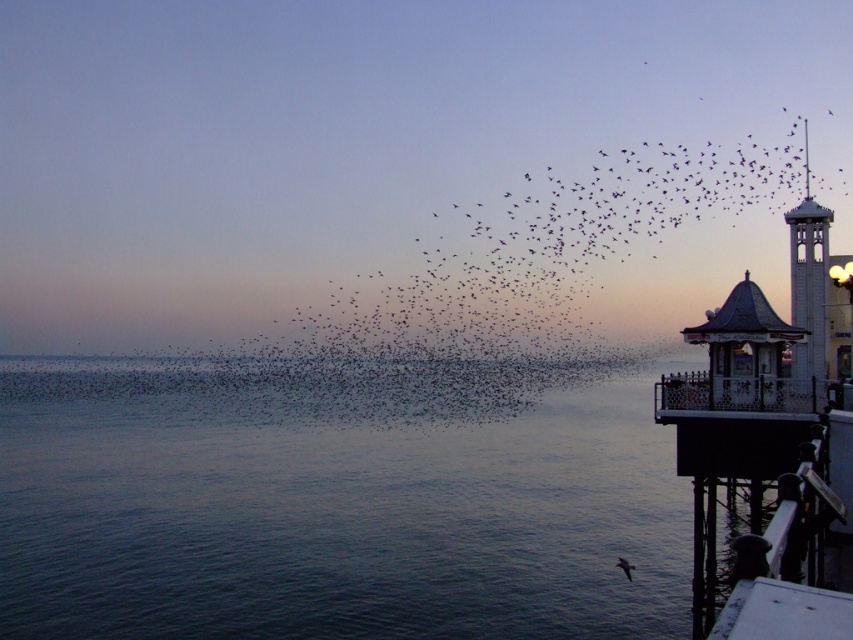
Does wooden railing at right appear under white wooden bell tower at right?

Indeed, wooden railing at right is positioned under white wooden bell tower at right.

Which of these two, wooden railing at right or white wooden bell tower at right, stands shorter?

Standing shorter between the two is wooden railing at right.

Between point (763, 388) and point (816, 326), which one is positioned behind?

The point (816, 326) is more distant.

This screenshot has width=853, height=640. Identify the location of wooden railing at right. pos(756,472).

In the scene shown: Is black matte birds at upper center shorter than wooden railing at right?

No, black matte birds at upper center is not shorter than wooden railing at right.

This screenshot has width=853, height=640. Find the location of `black matte birds at upper center`. black matte birds at upper center is located at coordinates (463, 298).

Between point (407, 378) and point (776, 508), which one is positioned in front?

Positioned in front is point (776, 508).

Where is `black matte birds at upper center`? black matte birds at upper center is located at coordinates (463, 298).

Does point (798, 531) lie in front of point (618, 563)?

Yes, point (798, 531) is in front of point (618, 563).

Measure the distance between wooden railing at right and camera.

30.35 feet

Locate an element on the screen. wooden railing at right is located at coordinates (756, 472).